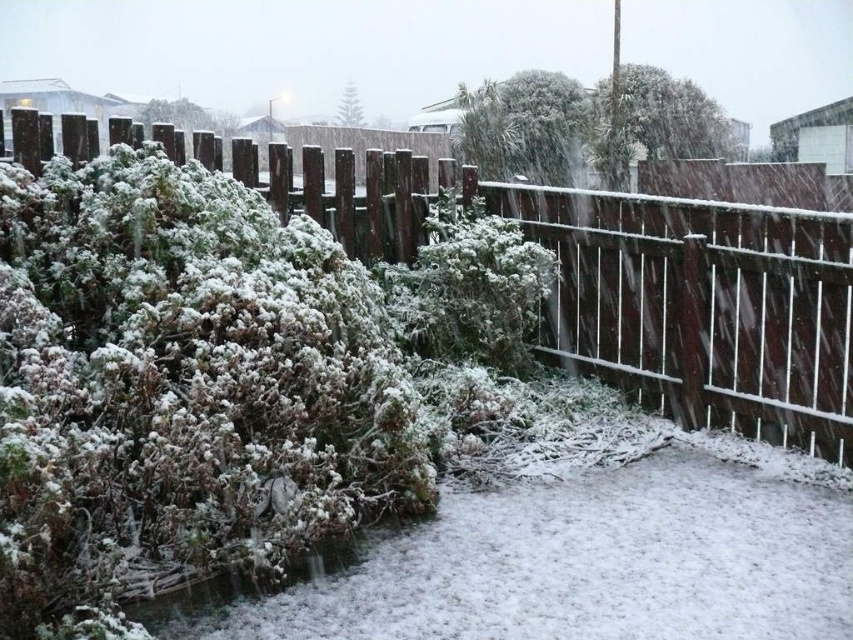
From the picture: You are standing in the snowy scene and want to place a small snowman between the frosted green bush at center and the frosted green bush at upper center. Based on their positions, where should the snowman be placed?

The frosted green bush at center is below the frosted green bush at upper center, so the snowman should be placed between them in the space below the upper center bush and above the center bush.

You are a photographer trying to capture the frosted green bush at center in your shot. However, the brown wooden fence at center is blocking your view. Can you move the fence to get a clear shot of the bush?

The brown wooden fence at center is in front of the frosted green bush at center, so you cannot move the fence as it is part of the scene. You will need to adjust your position or angle to capture the bush without the fence obstructing the view.